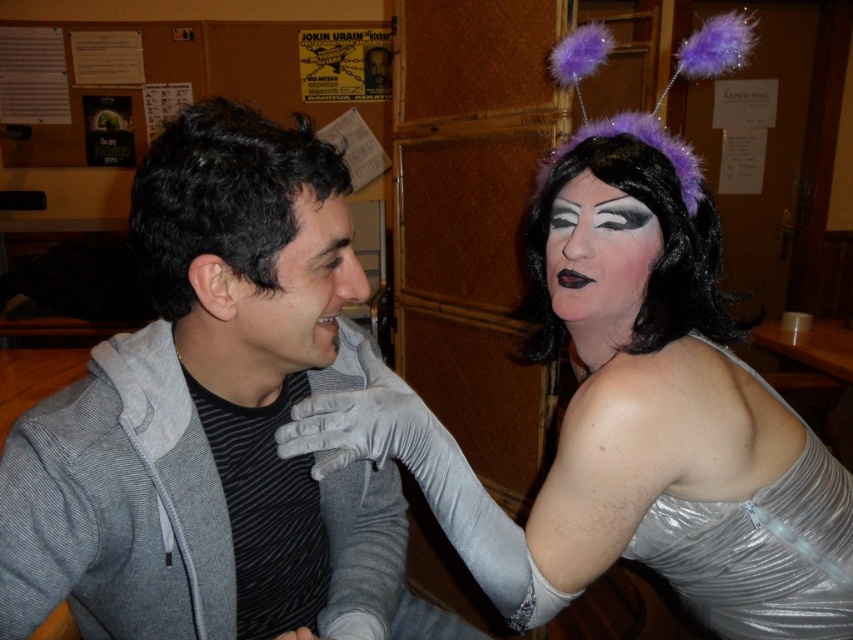
You are a photographer trying to capture a candid shot of both the matte gray hoodie at center and the matte silver face at upper right. Since you want both subjects to be in focus, which one should you focus on first to ensure depth of field captures both?

You should focus on the matte gray hoodie at center first because it is closer to the camera than the matte silver face at upper right, ensuring the depth of field will include both subjects.